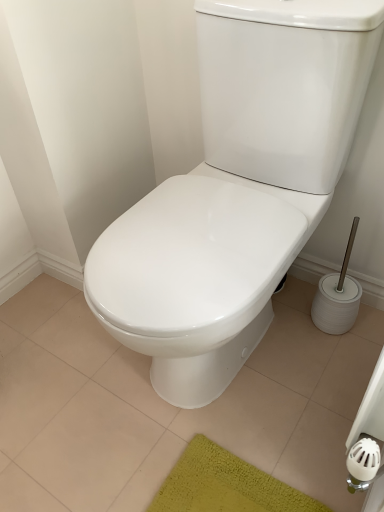
Question: From a real-world perspective, is white glossy toilet at center physically located above or below white glossy toilet at center?

Choices:
 (A) above
 (B) below

Answer: (B)

Question: Considering the positions of white glossy toilet at center and white glossy toilet at center in the image, is white glossy toilet at center wider or thinner than white glossy toilet at center?

Choices:
 (A) wide
 (B) thin

Answer: (A)

Question: Considering their positions, is white glossy toilet at center located in front of or behind white glossy toilet at center?

Choices:
 (A) front
 (B) behind

Answer: (B)

Question: Does point (188, 359) appear closer or farther from the camera than point (284, 451)?

Choices:
 (A) farther
 (B) closer

Answer: (B)

Question: Based on their positions, is white glossy toilet at center located to the left or right of white glossy toilet at center?

Choices:
 (A) left
 (B) right

Answer: (B)

Question: Is white glossy toilet at center taller or shorter than white glossy toilet at center?

Choices:
 (A) tall
 (B) short

Answer: (A)

Question: In terms of size, does white glossy toilet at center appear bigger or smaller than white glossy toilet at center?

Choices:
 (A) big
 (B) small

Answer: (A)